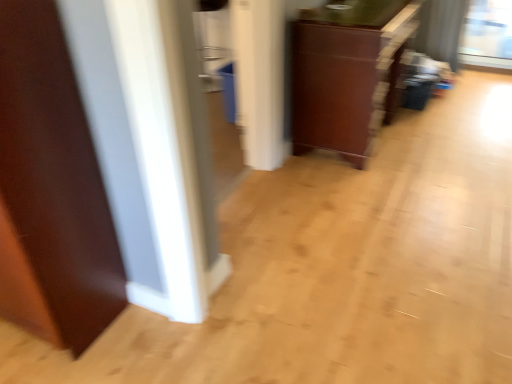
Describe the element at coordinates (347, 73) in the screenshot. The width and height of the screenshot is (512, 384). I see `matte brown cabinet at center` at that location.

Find the location of a particular element. Image resolution: width=512 pixels, height=384 pixels. matte brown cabinet at center is located at coordinates (347, 73).

Measure the distance between matte brown cabinet at center and camera.

A distance of 6.45 feet exists between matte brown cabinet at center and camera.

You are a GUI agent. You are given a task and a screenshot of the screen. Output one action in this format:
    pyautogui.click(x=<x>, y=<y>)
    Task: Click on the brown wood door at left
    
    Given the screenshot: What is the action you would take?
    pyautogui.click(x=51, y=190)

What do you see at coordinates (51, 190) in the screenshot? The height and width of the screenshot is (384, 512). I see `brown wood door at left` at bounding box center [51, 190].

This screenshot has height=384, width=512. Identify the location of matte brown cabinet at center. (347, 73).

Is brown wood door at left to the right of matte brown cabinet at center from the viewer's perspective?

Incorrect, brown wood door at left is not on the right side of matte brown cabinet at center.

Considering the relative positions of brown wood door at left and matte brown cabinet at center in the image provided, is brown wood door at left in front of matte brown cabinet at center?

That is True.

Which point is more distant from viewer, [93,224] or [368,36]?

The point [368,36] is behind.

From the image's perspective, is brown wood door at left located above or below matte brown cabinet at center?

brown wood door at left is situated lower than matte brown cabinet at center in the image.

Based on the photo, from a real-world perspective, is brown wood door at left located beneath matte brown cabinet at center?

Actually, brown wood door at left is physically above matte brown cabinet at center in the real world.

Considering the sizes of objects brown wood door at left and matte brown cabinet at center in the image provided, who is wider, brown wood door at left or matte brown cabinet at center?

matte brown cabinet at center is wider.

Considering the sizes of brown wood door at left and matte brown cabinet at center in the image, is brown wood door at left taller or shorter than matte brown cabinet at center?

brown wood door at left is taller than matte brown cabinet at center.

Is brown wood door at left bigger than matte brown cabinet at center?

No, brown wood door at left is not bigger than matte brown cabinet at center.

Is brown wood door at left not inside matte brown cabinet at center?

Indeed, brown wood door at left is completely outside matte brown cabinet at center.

Is there a large distance between brown wood door at left and matte brown cabinet at center?

brown wood door at left is far away from matte brown cabinet at center.

Is brown wood door at left turned away from matte brown cabinet at center?

That's right, brown wood door at left is facing away from matte brown cabinet at center.

How many degrees apart are the facing directions of brown wood door at left and matte brown cabinet at center?

The facing directions of brown wood door at left and matte brown cabinet at center are 89 degrees apart.

Find the location of a particular element. Image resolution: width=512 pixels, height=384 pixels. door below the matte brown cabinet at center (from the image's perspective) is located at coordinates (51, 190).

Visually, is matte brown cabinet at center positioned to the left or to the right of brown wood door at left?

matte brown cabinet at center is to the right of brown wood door at left.

Which object is further away from the camera taking this photo, matte brown cabinet at center or brown wood door at left?

matte brown cabinet at center.

Which is in front, point (360, 38) or point (92, 182)?

The point (92, 182) is more forward.

From the image's perspective, would you say matte brown cabinet at center is shown under brown wood door at left?

Incorrect, from the image's perspective, matte brown cabinet at center is higher than brown wood door at left.

From a real-world perspective, is matte brown cabinet at center above or below brown wood door at left?

matte brown cabinet at center is situated lower than brown wood door at left in the real world.

Is matte brown cabinet at center wider than brown wood door at left?

Indeed, matte brown cabinet at center has a greater width compared to brown wood door at left.

Between matte brown cabinet at center and brown wood door at left, which one has more height?

brown wood door at left is taller.

Is matte brown cabinet at center bigger than brown wood door at left?

Correct, matte brown cabinet at center is larger in size than brown wood door at left.

Is brown wood door at left inside matte brown cabinet at center?

No, matte brown cabinet at center does not contain brown wood door at left.

Can you see matte brown cabinet at center touching brown wood door at left?

matte brown cabinet at center and brown wood door at left are not in contact.

Is matte brown cabinet at center positioned with its back to brown wood door at left?

That's not correct — matte brown cabinet at center is not looking away from brown wood door at left.

How distant is matte brown cabinet at center from brown wood door at left?

matte brown cabinet at center is 1.54 meters from brown wood door at left.

You are a GUI agent. You are given a task and a screenshot of the screen. Output one action in this format:
    pyautogui.click(x=<x>, y=<y>)
    Task: Click on the cabinetry above the brown wood door at left (from the image's perspective)
    
    Given the screenshot: What is the action you would take?
    pyautogui.click(x=347, y=73)

Identify the location of cabinetry below the brown wood door at left (from a real-world perspective). (347, 73).

I want to click on cabinetry located behind the brown wood door at left, so click(347, 73).